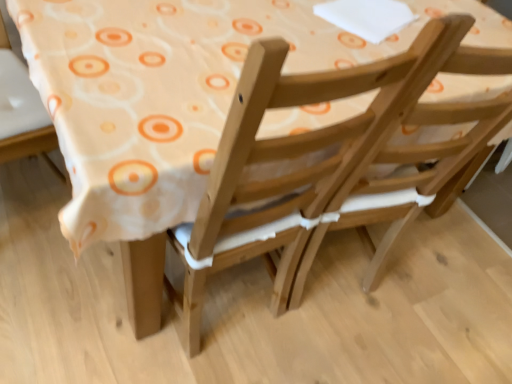
Question: Should I look upward or downward to see wooden chair at lower left, arranged as the second chair when viewed from the right?

Choices:
 (A) down
 (B) up

Answer: (B)

Question: Does natural wood chair at center, which ranks as the second chair in left-to-right order, come behind wooden chair at lower left, arranged as the second chair when viewed from the right?

Choices:
 (A) no
 (B) yes

Answer: (A)

Question: Is natural wood chair at center, which ranks as the second chair in left-to-right order, not within wooden chair at lower left, positioned as the 1th chair in left-to-right order?

Choices:
 (A) yes
 (B) no

Answer: (A)

Question: Does natural wood chair at center, acting as the 1th chair starting from the right, have a lesser height compared to wooden chair at lower left, arranged as the second chair when viewed from the right?

Choices:
 (A) yes
 (B) no

Answer: (B)

Question: Can you confirm if natural wood chair at center, acting as the 1th chair starting from the right, is positioned to the left of wooden chair at lower left, arranged as the second chair when viewed from the right?

Choices:
 (A) yes
 (B) no

Answer: (B)

Question: Is natural wood chair at center, acting as the 1th chair starting from the right, wider than wooden chair at lower left, positioned as the 1th chair in left-to-right order?

Choices:
 (A) yes
 (B) no

Answer: (A)

Question: From a real-world perspective, is natural wood chair at center, which ranks as the second chair in left-to-right order, physically below wooden chair at lower left, arranged as the second chair when viewed from the right?

Choices:
 (A) yes
 (B) no

Answer: (B)

Question: From a real-world perspective, does wooden chair at lower left, positioned as the 1th chair in left-to-right order, stand above natural wood chair at center, acting as the 1th chair starting from the right?

Choices:
 (A) no
 (B) yes

Answer: (A)

Question: From the image's perspective, is wooden chair at lower left, positioned as the 1th chair in left-to-right order, under natural wood chair at center, acting as the 1th chair starting from the right?

Choices:
 (A) no
 (B) yes

Answer: (A)

Question: Would you say wooden chair at lower left, positioned as the 1th chair in left-to-right order, is a long distance from natural wood chair at center, which ranks as the second chair in left-to-right order?

Choices:
 (A) no
 (B) yes

Answer: (A)

Question: From a real-world perspective, is wooden chair at lower left, positioned as the 1th chair in left-to-right order, below natural wood chair at center, which ranks as the second chair in left-to-right order?

Choices:
 (A) no
 (B) yes

Answer: (B)

Question: Is wooden chair at lower left, positioned as the 1th chair in left-to-right order, at the left side of natural wood chair at center, acting as the 1th chair starting from the right?

Choices:
 (A) yes
 (B) no

Answer: (A)

Question: From the image's perspective, would you say wooden chair at lower left, arranged as the second chair when viewed from the right, is positioned over natural wood chair at center, which ranks as the second chair in left-to-right order?

Choices:
 (A) yes
 (B) no

Answer: (A)

Question: From a real-world perspective, is natural wood chair at center, which ranks as the second chair in left-to-right order, above or below wooden chair at lower left, arranged as the second chair when viewed from the right?

Choices:
 (A) above
 (B) below

Answer: (A)